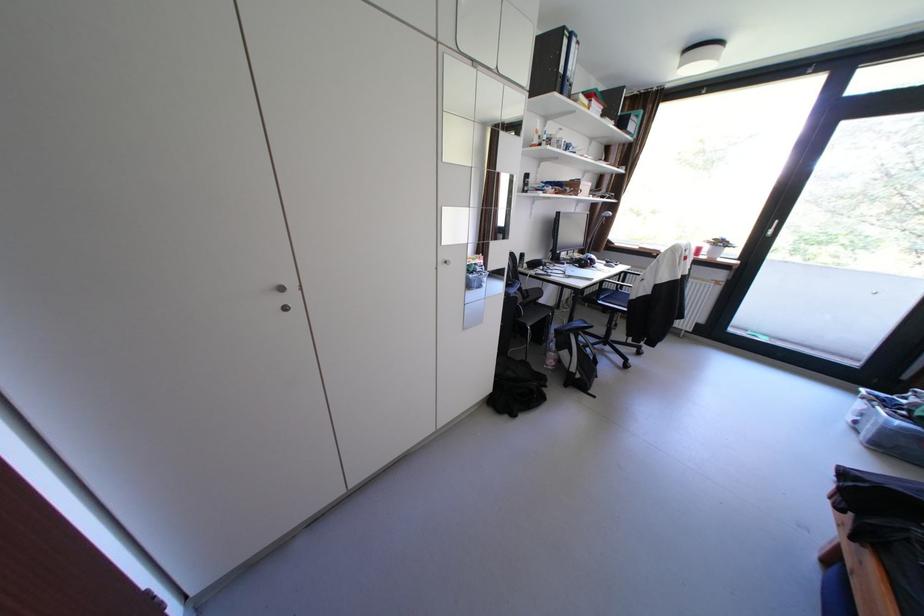
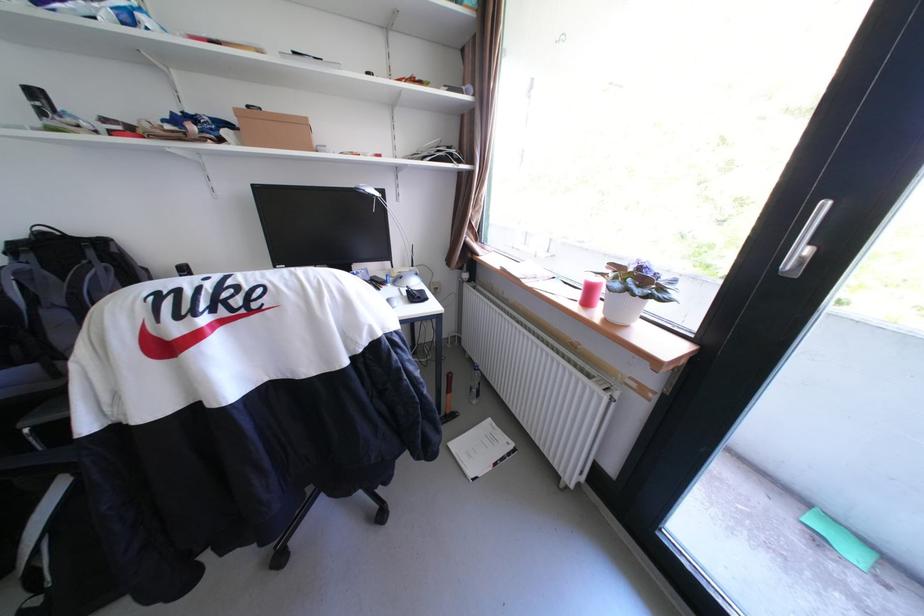
Question: I am providing you with two images of the same scene from different viewpoints. Which of the following objects are not visible in image2?

Choices:
 (A) white paper booklet
 (B) clear water bottle
 (C) toy throwing star
 (D) chair sitting surface

Answer: (D)